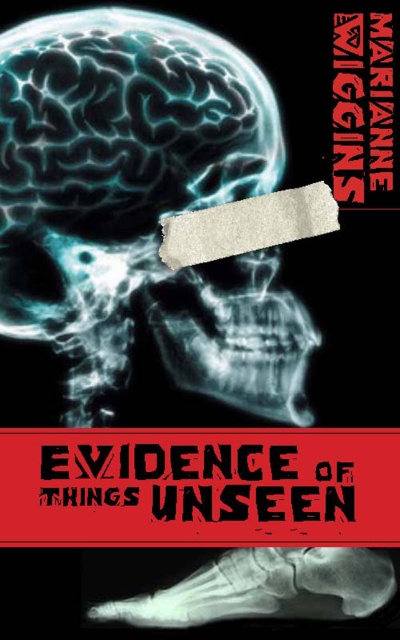
Can you confirm if x-ray skull at center is wider than x-ray bone at lower right?

Yes, x-ray skull at center is wider than x-ray bone at lower right.

Between x-ray skull at center and x-ray bone at lower right, which one appears on the left side from the viewer's perspective?

From the viewer's perspective, x-ray skull at center appears more on the left side.

Is point (72, 35) farther from camera compared to point (281, 552)?

That is False.

Locate an element on the screen. x-ray skull at center is located at coordinates (140, 209).